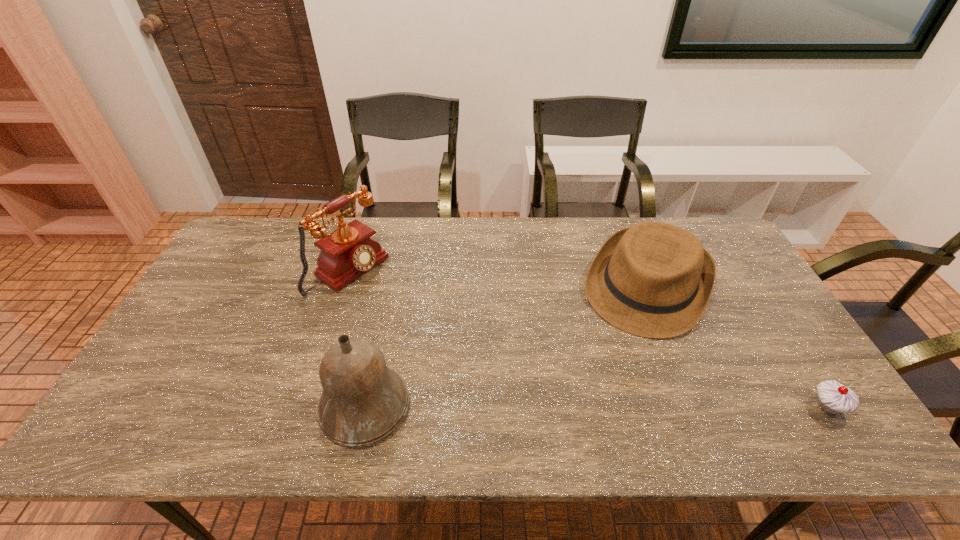
Identify the location of free space between the telephone and the second object from right to left. The width and height of the screenshot is (960, 540). (498, 279).

The height and width of the screenshot is (540, 960). I want to click on empty space between the second object from right to left and the rightmost object, so 737,347.

Where is `vacant region between the fedora and the shortest object`? This screenshot has width=960, height=540. vacant region between the fedora and the shortest object is located at coordinates (737, 347).

At what (x,y) coordinates should I click in order to perform the action: click on free space between the fedora and the bell. Please return your answer as a coordinate pair (x, y). This screenshot has width=960, height=540. Looking at the image, I should click on pyautogui.click(x=506, y=347).

Identify the location of vacant area that lies between the telephone and the cupcake. (588, 339).

Locate which object ranks in proximity to the fedora. Please provide its 2D coordinates. Your answer should be formatted as a tuple, i.e. [(x, y)], where the tuple contains the x and y coordinates of a point satisfying the conditions above.

[(833, 398)]

Image resolution: width=960 pixels, height=540 pixels. Find the location of `object that is the third closest one to the bell`. object that is the third closest one to the bell is located at coordinates (833, 398).

I want to click on vacant space that satisfies the following two spatial constraints: 1. on the back side of the third object from left to right; 2. on the left side of the bell, so click(x=391, y=286).

The image size is (960, 540). Find the location of `vacant space that satisfies the following two spatial constraints: 1. on the back side of the shortest object; 2. on the right side of the bell`. vacant space that satisfies the following two spatial constraints: 1. on the back side of the shortest object; 2. on the right side of the bell is located at coordinates (365, 407).

Locate an element on the screen. vacant area in the image that satisfies the following two spatial constraints: 1. on the front side of the second object from right to left; 2. on the left side of the telephone is located at coordinates (345, 286).